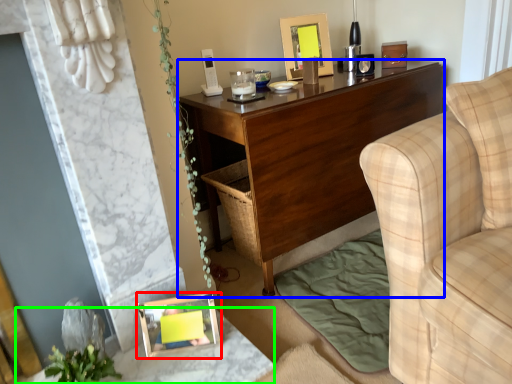
Question: Which object is the closest to the picture frame (highlighted by a red box)? Choose among these: desk (highlighted by a blue box) or table (highlighted by a green box).

Choices:
 (A) desk
 (B) table

Answer: (B)